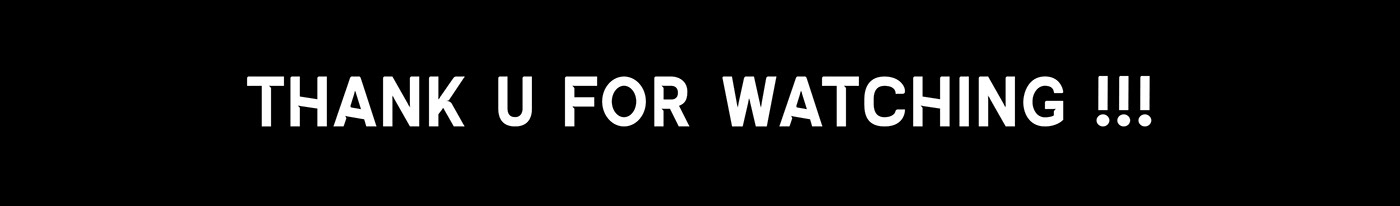
Where is `corner`? This screenshot has height=206, width=1400. corner is located at coordinates (24, 24), (22, 184), (1373, 12), (1382, 205).